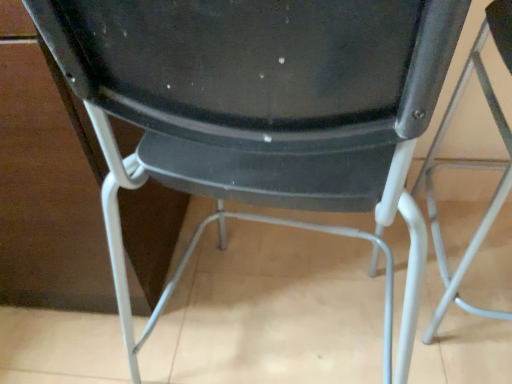
Identify the location of vacant area situated below metallic gray chair at right (from a real-world perspective). (480, 280).